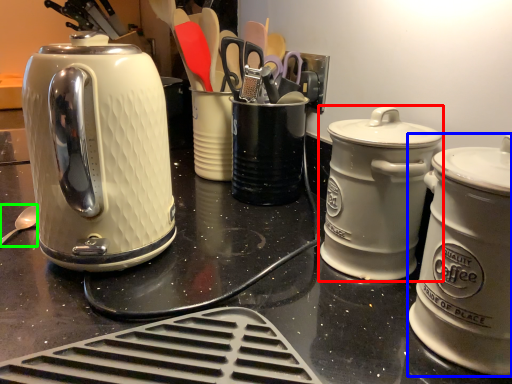
Question: Considering the real-world distances, which object is closest to kitchen appliance (highlighted by a red box)? kitchen appliance (highlighted by a blue box) or spoon (highlighted by a green box).

Choices:
 (A) kitchen appliance
 (B) spoon

Answer: (A)